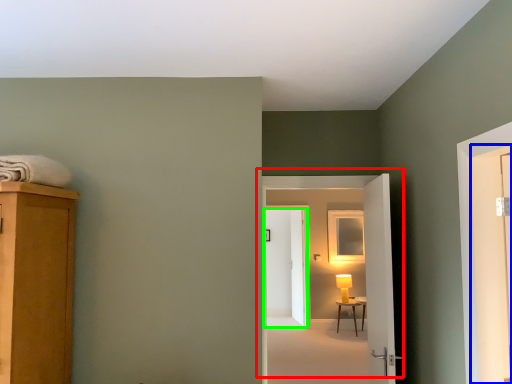
Question: Which object is positioned closest to door (highlighted by a red box)? Select from screen door (highlighted by a blue box) and door (highlighted by a green box).

Choices:
 (A) screen door
 (B) door

Answer: (A)